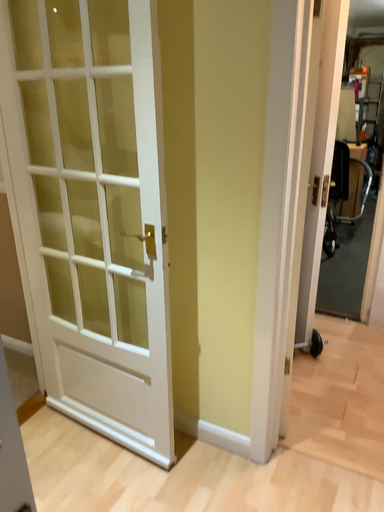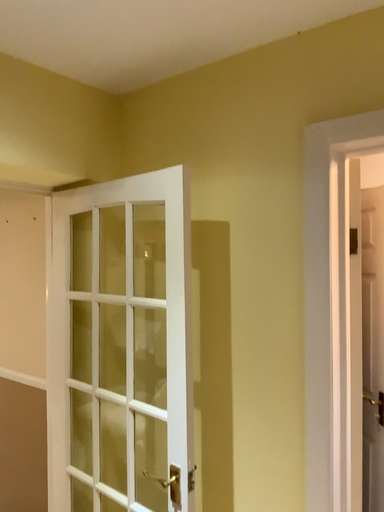
Question: Which way did the camera rotate in the video?

Choices:
 (A) rotated downward
 (B) rotated upward

Answer: (B)